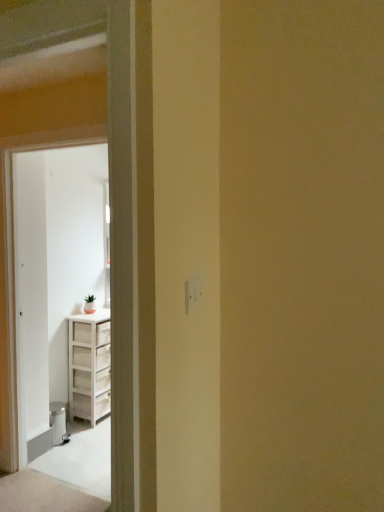
Question: Considering the relative positions of white wood screen door at left and white wood cabinet at left in the image provided, is white wood screen door at left to the right of white wood cabinet at left from the viewer's perspective?

Choices:
 (A) no
 (B) yes

Answer: (A)

Question: Considering the relative sizes of white wood screen door at left and white wood cabinet at left in the image provided, is white wood screen door at left thinner than white wood cabinet at left?

Choices:
 (A) no
 (B) yes

Answer: (B)

Question: Does white wood screen door at left appear on the left side of white wood cabinet at left?

Choices:
 (A) yes
 (B) no

Answer: (A)

Question: Is white wood screen door at left surrounding white wood cabinet at left?

Choices:
 (A) yes
 (B) no

Answer: (B)

Question: From the image's perspective, is white wood screen door at left on top of white wood cabinet at left?

Choices:
 (A) no
 (B) yes

Answer: (A)

Question: From a real-world perspective, does white wood screen door at left stand above white wood cabinet at left?

Choices:
 (A) no
 (B) yes

Answer: (A)

Question: Is white wood cabinet at left smaller than white wood screen door at left?

Choices:
 (A) yes
 (B) no

Answer: (B)

Question: Is white wood cabinet at left shorter than white wood screen door at left?

Choices:
 (A) yes
 (B) no

Answer: (A)

Question: Is white wood cabinet at left directly adjacent to white wood screen door at left?

Choices:
 (A) yes
 (B) no

Answer: (B)

Question: Is white wood cabinet at left facing away from white wood screen door at left?

Choices:
 (A) yes
 (B) no

Answer: (B)

Question: Is white wood cabinet at left wider than white wood screen door at left?

Choices:
 (A) no
 (B) yes

Answer: (B)

Question: Considering the relative sizes of white wood cabinet at left and white wood screen door at left in the image provided, is white wood cabinet at left taller than white wood screen door at left?

Choices:
 (A) no
 (B) yes

Answer: (A)

Question: From the image's perspective, is white wood cabinet at left above or below white wood screen door at left?

Choices:
 (A) above
 (B) below

Answer: (A)